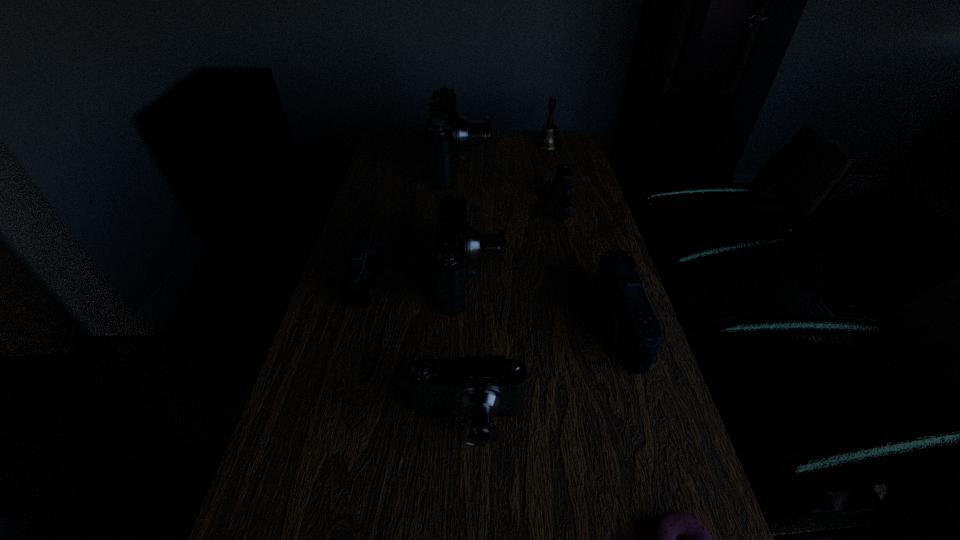
This screenshot has height=540, width=960. I want to click on the farthest camcorder, so click(448, 133).

At what (x,y) coordinates should I click in order to perform the action: click on the tallest camcorder. Please return your answer as a coordinate pair (x, y). This screenshot has width=960, height=540. Looking at the image, I should click on (448, 133).

Find the location of a particular element. bell is located at coordinates (548, 140).

At what (x,y) coordinates should I click in order to perform the action: click on the second tallest camcorder. Please return your answer as a coordinate pair (x, y). Looking at the image, I should click on (456, 244).

Locate an element on the screen. This screenshot has height=540, width=960. the second nearest blue camcorder is located at coordinates (456, 244).

At what (x,y) coordinates should I click in order to perform the action: click on the third farthest object. Please return your answer as a coordinate pair (x, y). The image size is (960, 540). Looking at the image, I should click on (560, 191).

This screenshot has height=540, width=960. Identify the location of headset. (560, 191).

Find the location of a particular element. Image resolution: width=960 pixels, height=540 pixels. the bigger black camcorder is located at coordinates (627, 319).

The height and width of the screenshot is (540, 960). I want to click on the right black camcorder, so click(627, 319).

At what (x,y) coordinates should I click in order to perform the action: click on the second nearest object. Please return your answer as a coordinate pair (x, y). Looking at the image, I should click on (479, 389).